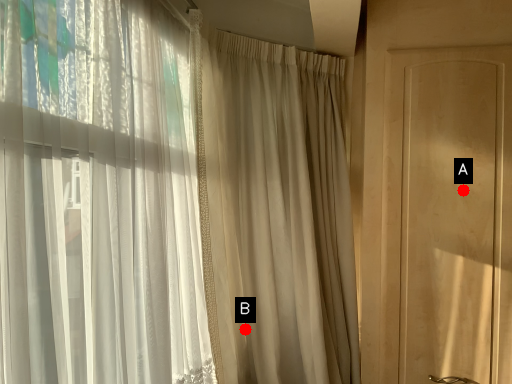
Question: Two points are circled on the image, labeled by A and B beside each circle. Which point is closer to the camera taking this photo?

Choices:
 (A) A is closer
 (B) B is closer

Answer: (A)